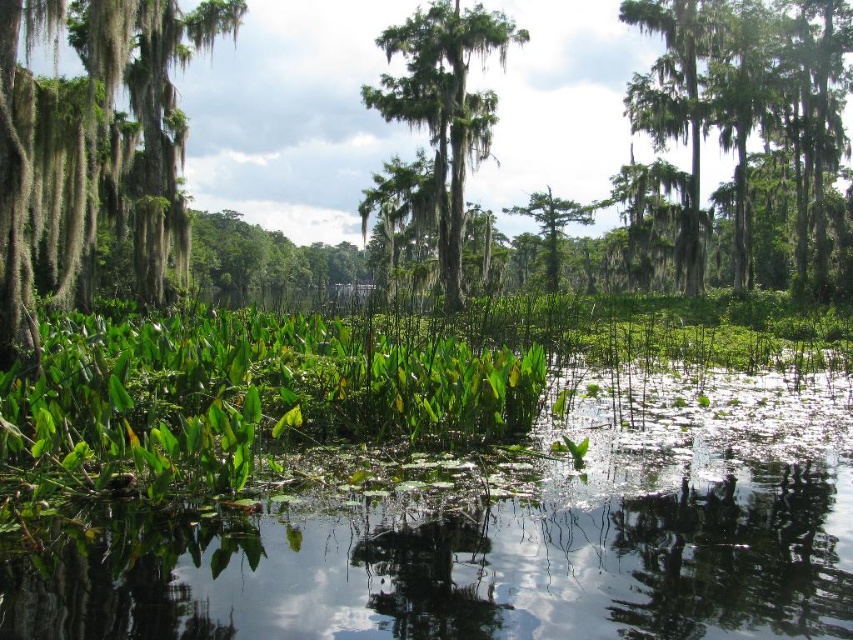
Is green mossy tree at upper right shorter than green leafy tree at center?

No, green mossy tree at upper right is not shorter than green leafy tree at center.

Can you confirm if green mossy tree at upper right is taller than green leafy tree at center?

Indeed, green mossy tree at upper right has a greater height compared to green leafy tree at center.

Between point (830, 51) and point (548, 212), which one is positioned behind?

Point (548, 212)

The height and width of the screenshot is (640, 853). In order to click on green mossy tree at upper right in this screenshot , I will do `click(747, 100)`.

The width and height of the screenshot is (853, 640). What are the coordinates of `green mossy tree at left` in the screenshot? It's located at (94, 147).

Looking at this image, can you confirm if green mossy tree at left is positioned above green mossy tree at center?

Incorrect, green mossy tree at left is not positioned above green mossy tree at center.

The image size is (853, 640). What do you see at coordinates (94, 147) in the screenshot?
I see `green mossy tree at left` at bounding box center [94, 147].

Where is `green mossy tree at left`? green mossy tree at left is located at coordinates (94, 147).

Does green mossy tree at left appear over green leafy tree at center?

Actually, green mossy tree at left is below green leafy tree at center.

Who is positioned more to the left, green mossy tree at left or green leafy tree at center?

green mossy tree at left is more to the left.

Is point (115, 108) in front of point (544, 232)?

That is True.

Locate an element on the screen. This screenshot has width=853, height=640. green mossy tree at left is located at coordinates (94, 147).